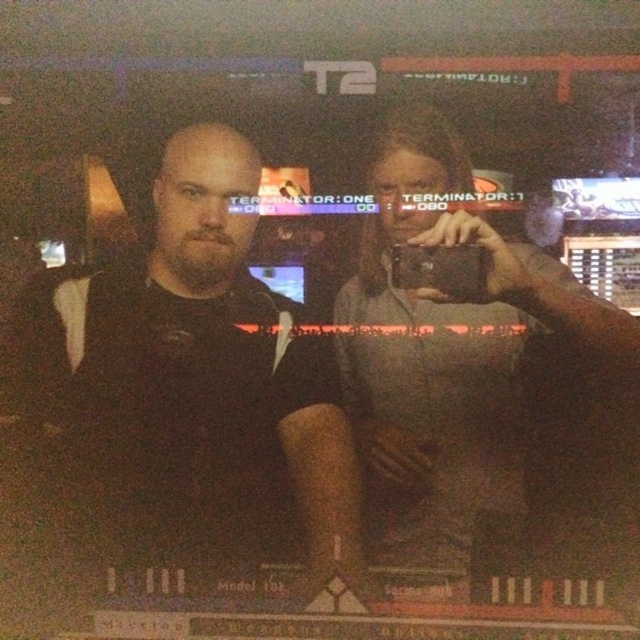
Based on the photo, how far apart are gray fabric shirt at upper center and black matte camera at center?

gray fabric shirt at upper center is 8.73 inches away from black matte camera at center.

How far apart are gray fabric shirt at upper center and black matte camera at center?

The distance of gray fabric shirt at upper center from black matte camera at center is 8.73 inches.

This screenshot has height=640, width=640. I want to click on gray fabric shirt at upper center, so click(472, 376).

The height and width of the screenshot is (640, 640). Identify the location of gray fabric shirt at upper center. (472, 376).

Is black matte shirt at center to the left of black matte camera at center from the viewer's perspective?

Yes, black matte shirt at center is to the left of black matte camera at center.

Image resolution: width=640 pixels, height=640 pixels. I want to click on black matte shirt at center, so click(195, 380).

Is point (48, 362) closer to viewer compared to point (588, 344)?

No, it is behind (588, 344).

Is black matte shirt at center positioned before gray fabric shirt at upper center?

No, black matte shirt at center is behind gray fabric shirt at upper center.

Who is more distant from viewer, (196, 260) or (464, 145)?

The point (196, 260) is more distant.

Image resolution: width=640 pixels, height=640 pixels. What are the coordinates of `black matte shirt at center` in the screenshot? It's located at (195, 380).